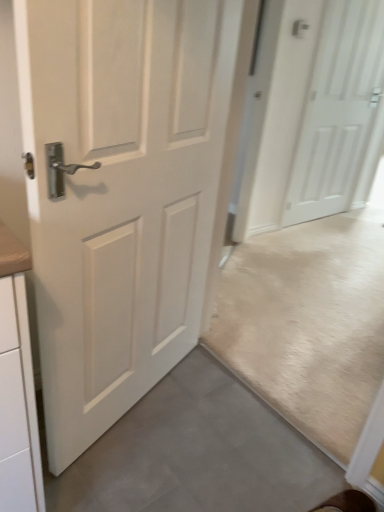
Question: Can you confirm if white matte door at center, the first door when ordered from front to back, is thinner than white matte door at upper right, which appears as the 1th door when viewed from the back?

Choices:
 (A) yes
 (B) no

Answer: (B)

Question: Can you confirm if white matte door at center, the 2th door viewed from the right, is wider than white matte door at upper right, the 2th door positioned from the left?

Choices:
 (A) no
 (B) yes

Answer: (B)

Question: From the image's perspective, is white matte door at center, which is the 1th door from left to right, on top of white matte door at upper right, which ranks as the second door in front-to-back order?

Choices:
 (A) yes
 (B) no

Answer: (B)

Question: Is white matte door at center, which is the 1th door from left to right, turned away from white matte door at upper right, the 2th door positioned from the left?

Choices:
 (A) yes
 (B) no

Answer: (B)

Question: Is white matte door at center, the 2th door viewed from the right, not within white matte door at upper right, which ranks as the second door in front-to-back order?

Choices:
 (A) yes
 (B) no

Answer: (A)

Question: From the image's perspective, is white matte door at center, which is the 1th door from left to right, below white matte door at upper right, which appears as the 1th door when viewed from the back?

Choices:
 (A) no
 (B) yes

Answer: (B)

Question: Can we say white matte door at upper right, the 2th door positioned from the left, lies outside white matte door at center, which appears as the 2th door when viewed from the back?

Choices:
 (A) no
 (B) yes

Answer: (B)

Question: Does white matte door at upper right, which appears as the 1th door when viewed from the back, appear on the right side of white matte door at center, the 2th door viewed from the right?

Choices:
 (A) yes
 (B) no

Answer: (A)

Question: Does white matte door at upper right, which ranks as the second door in front-to-back order, contain white matte door at center, the 2th door viewed from the right?

Choices:
 (A) yes
 (B) no

Answer: (B)

Question: From the image's perspective, is white matte door at upper right, which ranks as the second door in front-to-back order, over white matte door at center, which appears as the 2th door when viewed from the back?

Choices:
 (A) no
 (B) yes

Answer: (B)

Question: Is white matte door at upper right, the 2th door positioned from the left, next to white matte door at center, the 2th door viewed from the right?

Choices:
 (A) no
 (B) yes

Answer: (A)

Question: Is white matte door at upper right, the first door from the right, closer to the viewer compared to white matte door at center, the first door when ordered from front to back?

Choices:
 (A) no
 (B) yes

Answer: (A)

Question: Considering the positions of white matte door at center, which appears as the 2th door when viewed from the back, and white matte door at upper right, the first door from the right, in the image, is white matte door at center, which appears as the 2th door when viewed from the back, taller or shorter than white matte door at upper right, the first door from the right,?

Choices:
 (A) tall
 (B) short

Answer: (B)